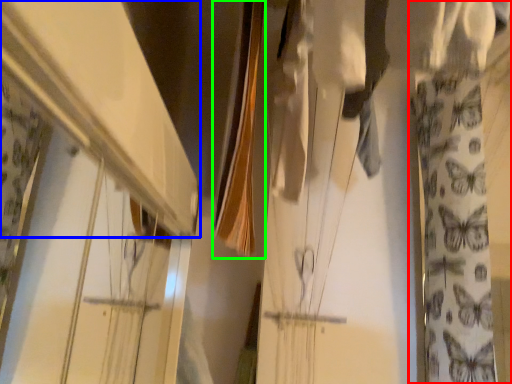
Question: Considering the real-world distances, which object is farthest from curtain (highlighted by a red box)? shelf (highlighted by a blue box) or clothesline (highlighted by a green box)?

Choices:
 (A) shelf
 (B) clothesline

Answer: (A)